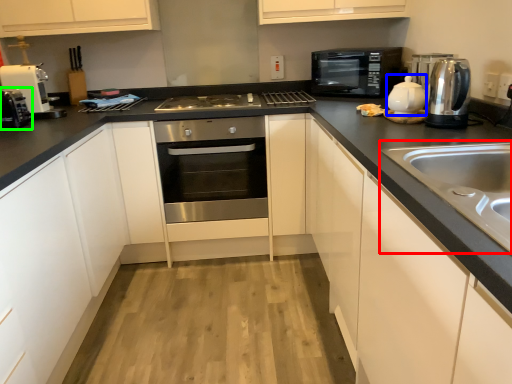
Question: Which object is positioned closest to sink (highlighted by a red box)? Select from tea pot (highlighted by a blue box) and toaster (highlighted by a green box).

Choices:
 (A) tea pot
 (B) toaster

Answer: (A)